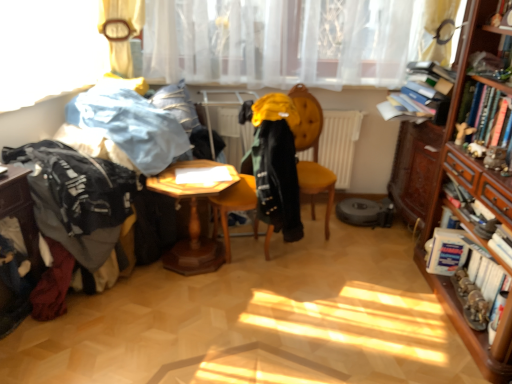
Image resolution: width=512 pixels, height=384 pixels. What are the coordinates of `vacant area that lies between wooden hexagonal table at center, marked as the second table in a left-to-right arrangement, and wooden bookcase at right` in the screenshot? It's located at (342, 295).